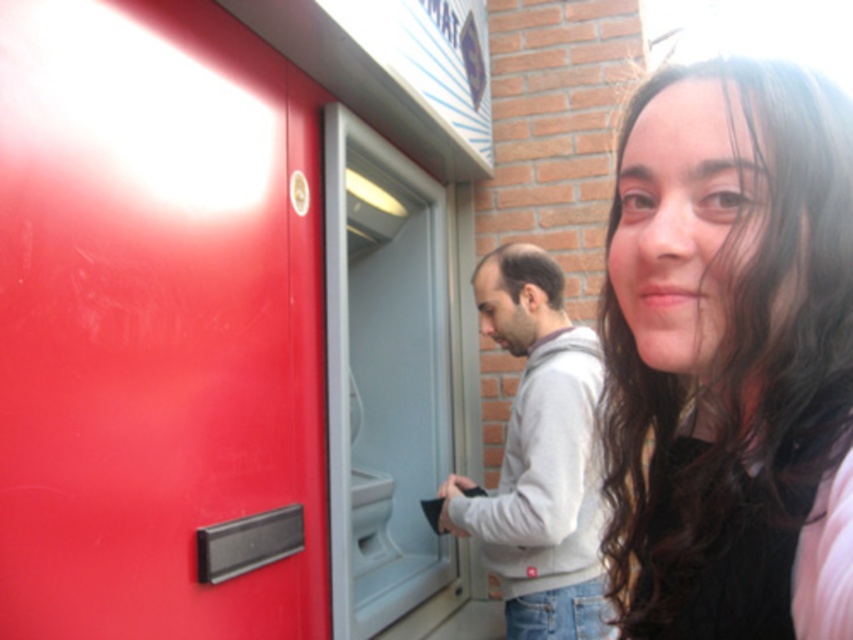
Question: Which point is closer to the camera?

Choices:
 (A) gray fleece hoodie at center
 (B) smooth brown hair at upper right

Answer: (B)

Question: Is the position of smooth brown hair at upper right more distant than that of gray fleece hoodie at center?

Choices:
 (A) yes
 (B) no

Answer: (B)

Question: Is smooth brown hair at upper right thinner than gray fleece hoodie at center?

Choices:
 (A) yes
 (B) no

Answer: (A)

Question: Does smooth brown hair at upper right appear under gray fleece hoodie at center?

Choices:
 (A) no
 (B) yes

Answer: (A)

Question: Which point appears closest to the camera in this image?

Choices:
 (A) (548, 435)
 (B) (636, 531)

Answer: (B)

Question: Among these objects, which one is farthest from the camera?

Choices:
 (A) gray fleece hoodie at center
 (B) smooth brown hair at upper right

Answer: (A)